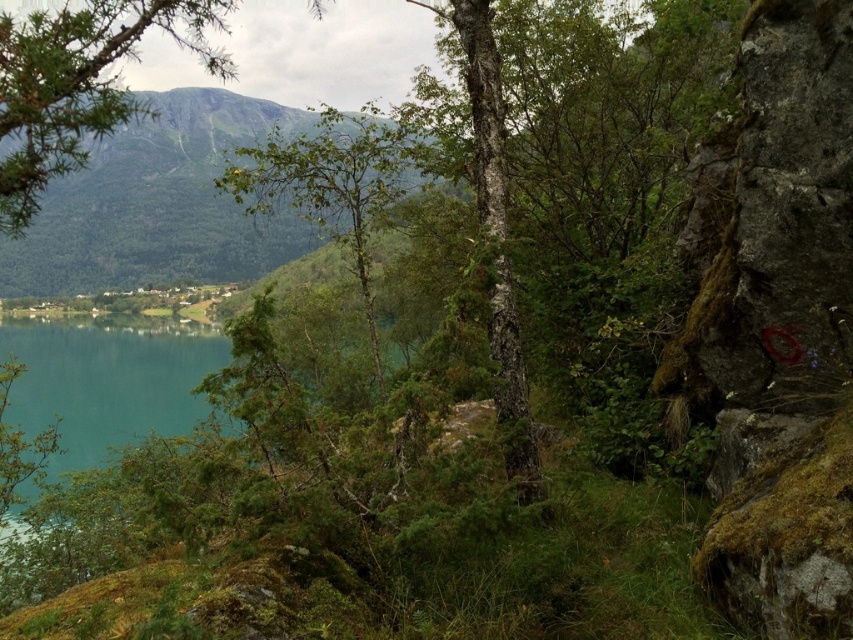
Does point (132, 244) come in front of point (16, 136)?

No, (132, 244) is further to viewer.

Who is positioned more to the left, green textured mountain at upper left or green needle-like leaves at upper left?

From the viewer's perspective, green textured mountain at upper left appears more on the left side.

Locate an element on the screen. green textured mountain at upper left is located at coordinates (160, 204).

Identify the location of green textured mountain at upper left. click(160, 204).

Consider the image. Who is higher up, mossy rock at right or green textured mountain at upper left?

green textured mountain at upper left

Is mossy rock at right to the right of green textured mountain at upper left from the viewer's perspective?

Indeed, mossy rock at right is positioned on the right side of green textured mountain at upper left.

At what (x,y) coordinates should I click in order to perform the action: click on mossy rock at right. Please return your answer as a coordinate pair (x, y). Image resolution: width=853 pixels, height=640 pixels. Looking at the image, I should click on (776, 323).

Find the location of `mossy rock at right`. mossy rock at right is located at coordinates (776, 323).

Consider the image. Can you confirm if green needle-like leaves at upper left is smaller than green leafy tree at center?

No, green needle-like leaves at upper left is not smaller than green leafy tree at center.

Does green needle-like leaves at upper left lie in front of green leafy tree at center?

Yes, green needle-like leaves at upper left is in front of green leafy tree at center.

The image size is (853, 640). What are the coordinates of `green needle-like leaves at upper left` in the screenshot? It's located at (79, 84).